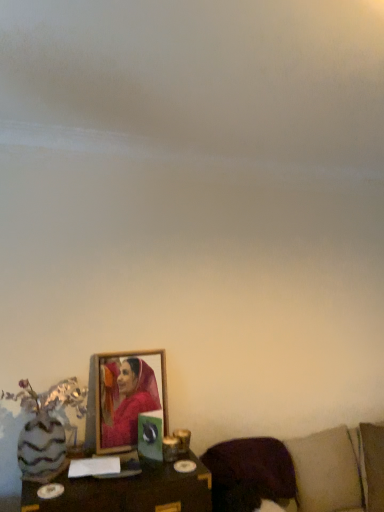
Where is `brown fabric couch at lower right`? This screenshot has height=512, width=384. brown fabric couch at lower right is located at coordinates (300, 472).

Describe the element at coordinates (128, 490) in the screenshot. The height and width of the screenshot is (512, 384). I see `wooden table at lower center` at that location.

Where is `wooden frame at center`? Image resolution: width=384 pixels, height=512 pixels. wooden frame at center is located at coordinates (122, 398).

Is there a large distance between purple fabric pillow at lower right and wooden table at lower center?

No.

Measure the distance between purple fabric pillow at lower right and wooden table at lower center.

purple fabric pillow at lower right and wooden table at lower center are 13.04 inches apart.

Based on their positions, is purple fabric pillow at lower right located to the left or right of wooden table at lower center?

purple fabric pillow at lower right is positioned on wooden table at lower center's right side.

Is purple fabric pillow at lower right positioned with its back to wooden table at lower center?

No, purple fabric pillow at lower right is not facing the opposite direction of wooden table at lower center.

Looking at this image, in terms of size, does brown fabric couch at lower right appear bigger or smaller than purple fabric pillow at lower right?

In the image, brown fabric couch at lower right appears to be larger than purple fabric pillow at lower right.

From their relative heights in the image, would you say brown fabric couch at lower right is taller or shorter than purple fabric pillow at lower right?

Clearly, brown fabric couch at lower right is taller compared to purple fabric pillow at lower right.

Is brown fabric couch at lower right not near purple fabric pillow at lower right?

No, brown fabric couch at lower right is not far away from purple fabric pillow at lower right.

Is purple fabric pillow at lower right not near brown fabric couch at lower right?

No, purple fabric pillow at lower right is not far from brown fabric couch at lower right.

Does point (255, 462) appear closer or farther from the camera than point (363, 474)?

Point (255, 462).

Which is behind, purple fabric pillow at lower right or brown fabric couch at lower right?

purple fabric pillow at lower right is further away from the camera.

Do you think brown fabric couch at lower right is within wooden table at lower center, or outside of it?

brown fabric couch at lower right lies outside wooden table at lower center.

Is point (212, 476) behind point (193, 494)?

Yes, point (212, 476) is behind point (193, 494).

Which object is closer to the camera taking this photo, brown fabric couch at lower right or wooden table at lower center?

brown fabric couch at lower right.

How different are the orientations of brown fabric couch at lower right and wooden table at lower center in degrees?

The angle between the facing direction of brown fabric couch at lower right and the facing direction of wooden table at lower center is 0.249 degrees.

Is wooden frame at center wider than wooden table at lower center?

No.

Does wooden frame at center lie in front of wooden table at lower center?

No, wooden frame at center is further to the viewer.

In the scene shown: Could you tell me if wooden frame at center is turned towards wooden table at lower center?

No.

Is wooden frame at center to the left or to the right of wooden table at lower center in the image?

From the image, it's evident that wooden frame at center is to the right of wooden table at lower center.

Considering the sizes of objects wooden table at lower center and wooden frame at center in the image provided, who is shorter, wooden table at lower center or wooden frame at center?

With less height is wooden table at lower center.

Based on their sizes in the image, would you say wooden table at lower center is bigger or smaller than wooden frame at center?

wooden table at lower center is bigger than wooden frame at center.

From the image's perspective, who appears lower, wooden table at lower center or wooden frame at center?

wooden table at lower center, from the image's perspective.

This screenshot has height=512, width=384. What are the coordinates of `table that is below the wooden frame at center (from the image's perspective)` in the screenshot? It's located at (128, 490).

Are purple fabric pillow at lower right and wooden frame at center located far from each other?

No, there isn't a large distance between purple fabric pillow at lower right and wooden frame at center.

Between purple fabric pillow at lower right and wooden frame at center, which one has less height?

purple fabric pillow at lower right.

Considering the relative sizes of purple fabric pillow at lower right and wooden frame at center in the image provided, is purple fabric pillow at lower right wider than wooden frame at center?

Indeed, purple fabric pillow at lower right has a greater width compared to wooden frame at center.

From the image's perspective, is purple fabric pillow at lower right located beneath wooden frame at center?

Yes, from the image's perspective, purple fabric pillow at lower right is below wooden frame at center.

The height and width of the screenshot is (512, 384). Find the location of `pillow behind the wooden table at lower center`. pillow behind the wooden table at lower center is located at coordinates (249, 473).

Locate an element on the screen. furniture on the right of the purple fabric pillow at lower right is located at coordinates (300, 472).

From the image, which object appears to be farther from wooden table at lower center, brown fabric couch at lower right or purple fabric pillow at lower right?

brown fabric couch at lower right.

In the scene shown: From the image, which object appears to be nearer to wooden table at lower center, wooden frame at center or purple fabric pillow at lower right?

wooden frame at center is closer to wooden table at lower center.

Estimate the real-world distances between objects in this image. Which object is closer to wooden frame at center, purple fabric pillow at lower right or brown fabric couch at lower right?

purple fabric pillow at lower right lies closer to wooden frame at center than the other object.

Considering their positions, is wooden table at lower center positioned further to purple fabric pillow at lower right than brown fabric couch at lower right?

Among the two, wooden table at lower center is located further to purple fabric pillow at lower right.

Looking at the image, which one is located further to purple fabric pillow at lower right, wooden frame at center or wooden table at lower center?

Among the two, wooden frame at center is located further to purple fabric pillow at lower right.

Estimate the real-world distances between objects in this image. Which object is closer to brown fabric couch at lower right, purple fabric pillow at lower right or wooden frame at center?

purple fabric pillow at lower right is positioned closer to the anchor brown fabric couch at lower right.

Looking at this image, when comparing their distances from brown fabric couch at lower right, does wooden table at lower center or wooden frame at center seem further?

wooden frame at center.

When comparing their distances from wooden frame at center, does wooden table at lower center or purple fabric pillow at lower right seem further?

Among the two, purple fabric pillow at lower right is located further to wooden frame at center.

Locate an element on the screen. Image resolution: width=384 pixels, height=512 pixels. picture frame between wooden table at lower center and purple fabric pillow at lower right from left to right is located at coordinates (122, 398).

Find the location of a particular element. pillow located between wooden frame at center and brown fabric couch at lower right in the left-right direction is located at coordinates (249, 473).

Locate an element on the screen. pillow between wooden table at lower center and brown fabric couch at lower right is located at coordinates (249, 473).

Locate an element on the screen. The image size is (384, 512). picture frame located between wooden table at lower center and brown fabric couch at lower right in the left-right direction is located at coordinates (122, 398).